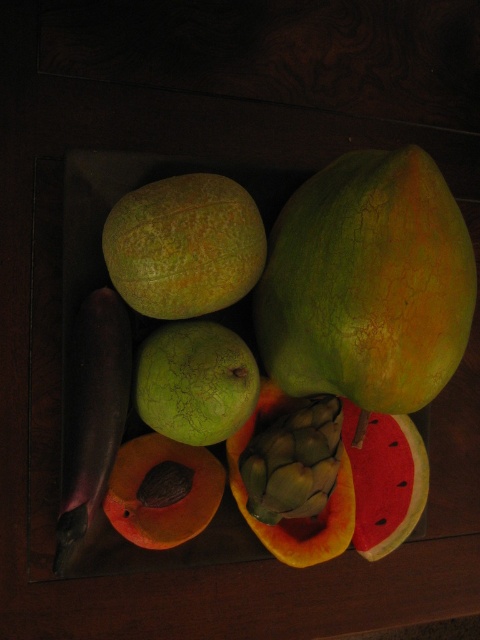
Question: Can you confirm if watermelon at lower right is bigger than yellow-green papaya at center?

Choices:
 (A) no
 (B) yes

Answer: (A)

Question: Does green rough papaya at upper right have a greater width compared to green matte melon at center?

Choices:
 (A) no
 (B) yes

Answer: (B)

Question: Considering the real-world distances, which object is farthest from the green rough papaya at upper right?

Choices:
 (A) smooth orange papaya at center
 (B) yellow-green papaya at center
 (C) green cracked melon at center
 (D) watermelon at lower right

Answer: (A)

Question: Which point is closer to the camera?

Choices:
 (A) smooth orange papaya at center
 (B) green cracked melon at center
 (C) yellow-green papaya at center

Answer: (B)

Question: Does green matte melon at center have a lesser width compared to smooth orange papaya at center?

Choices:
 (A) yes
 (B) no

Answer: (B)

Question: Estimate the real-world distances between objects in this image. Which object is farther from the green rough papaya at upper right?

Choices:
 (A) smooth orange papaya at center
 (B) green matte melon at center

Answer: (A)